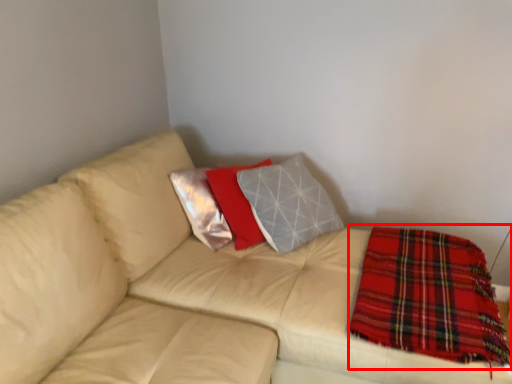
Question: Observing the image, what is the correct spatial positioning of blanket (annotated by the red box) in reference to studio couch?

Choices:
 (A) left
 (B) right

Answer: (B)